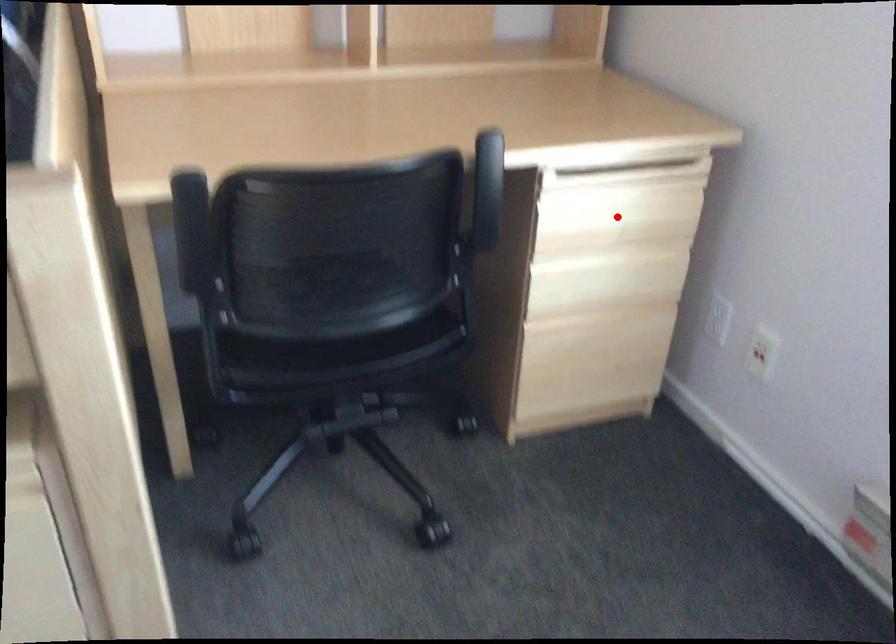
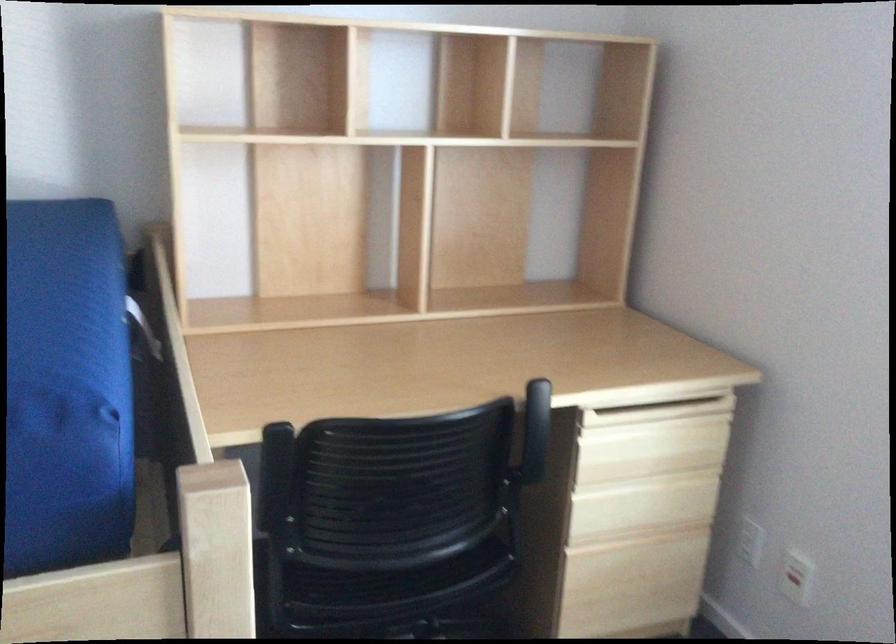
Where in the second image is the point corresponding to the highlighted location from the first image?

(650, 448)